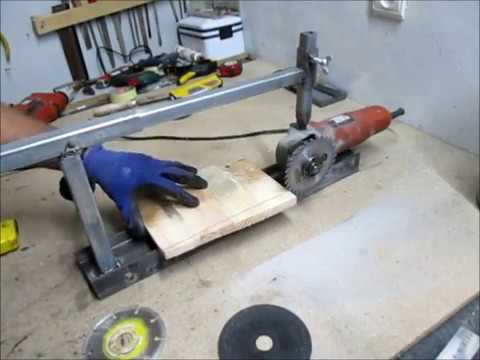
Where is `wall`? Image resolution: width=480 pixels, height=360 pixels. wall is located at coordinates (361, 41).